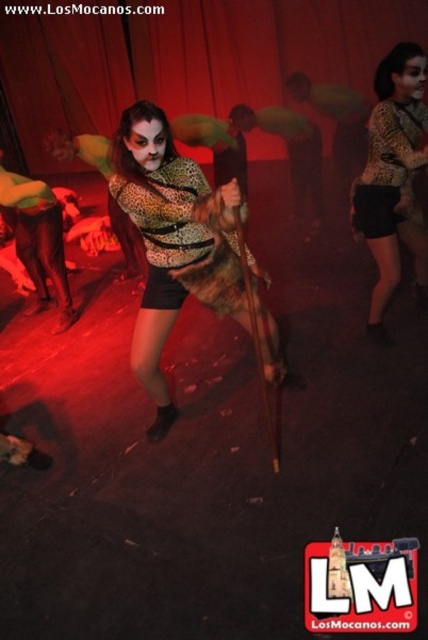
In the image with the woman in leopard print and the others in costumes, there is a point at coordinates [172,241]. Based on the scene description, where is this point located?

The point at [172,241] is on the leopard print top at center.

You are a photographer trying to capture the central figure in the scene. You notice two points in the image labeled as point 1 at coordinates point (139, 336) and point 2 at coordinates point (377, 116). Which point is closer to the camera, and thus likely to be in focus if you focus on that point?

Point (139, 336) is closer to the camera than point (377, 116), so focusing on point (139, 336) would likely keep the central figure in focus.